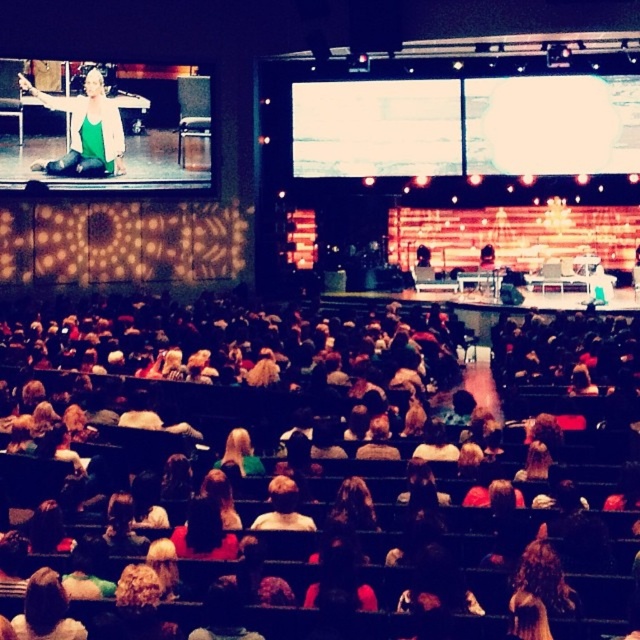
Can you confirm if green matte tank top at upper left is positioned to the left of blonde hair at center?

Indeed, green matte tank top at upper left is positioned on the left side of blonde hair at center.

Based on the photo, is green matte tank top at upper left taller than blonde hair at center?

Yes.

Does point (80, 152) come in front of point (228, 451)?

That is False.

The height and width of the screenshot is (640, 640). What are the coordinates of `green matte tank top at upper left` in the screenshot? It's located at (84, 131).